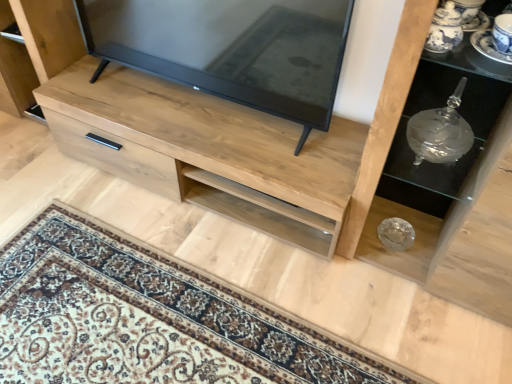
Question: Is transparent glass vase at right, the 1th shelf viewed from the back, outside blue and white porcelain saucer at upper right?

Choices:
 (A) no
 (B) yes

Answer: (B)

Question: From a real-world perspective, is transparent glass vase at right, the 1th shelf viewed from the back, physically above blue and white porcelain saucer at upper right?

Choices:
 (A) yes
 (B) no

Answer: (B)

Question: Is transparent glass vase at right, the 1th shelf viewed from the back, next to blue and white porcelain saucer at upper right?

Choices:
 (A) yes
 (B) no

Answer: (B)

Question: Can you confirm if transparent glass vase at right, the 1th shelf viewed from the back, is wider than blue and white porcelain saucer at upper right?

Choices:
 (A) no
 (B) yes

Answer: (B)

Question: Is transparent glass vase at right, the second shelf in the front-to-back sequence, positioned before blue and white porcelain saucer at upper right?

Choices:
 (A) no
 (B) yes

Answer: (A)

Question: Does transparent glass vase at right, the second shelf in the front-to-back sequence, have a lesser width compared to blue and white porcelain saucer at upper right?

Choices:
 (A) no
 (B) yes

Answer: (A)

Question: Is transparent glass vase at right, the 1th shelf viewed from the back, positioned with its back to matte black tv at center?

Choices:
 (A) no
 (B) yes

Answer: (A)

Question: From a real-world perspective, is transparent glass vase at right, the second shelf in the front-to-back sequence, positioned under matte black tv at center based on gravity?

Choices:
 (A) yes
 (B) no

Answer: (A)

Question: Does transparent glass vase at right, the 1th shelf viewed from the back, appear on the left side of matte black tv at center?

Choices:
 (A) yes
 (B) no

Answer: (B)

Question: Is transparent glass vase at right, the 1th shelf viewed from the back, aimed at matte black tv at center?

Choices:
 (A) no
 (B) yes

Answer: (A)

Question: Is transparent glass vase at right, the 1th shelf viewed from the back, further to the viewer compared to matte black tv at center?

Choices:
 (A) yes
 (B) no

Answer: (A)

Question: Would you consider transparent glass vase at right, the 1th shelf viewed from the back, to be distant from matte black tv at center?

Choices:
 (A) yes
 (B) no

Answer: (B)

Question: Does blue and white porcelain saucer at upper right have a greater height compared to matte black tv at center?

Choices:
 (A) yes
 (B) no

Answer: (B)